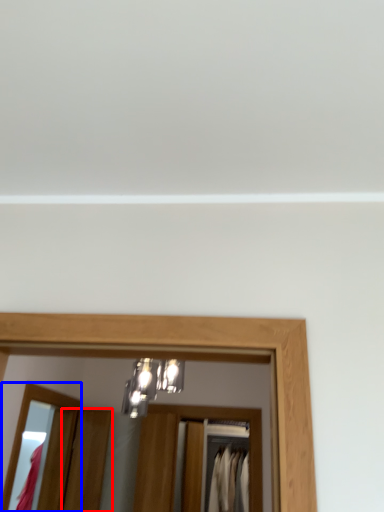
Question: Which object appears farthest to the camera in this image, door (highlighted by a red box) or mirror (highlighted by a blue box)?

Choices:
 (A) door
 (B) mirror

Answer: (A)